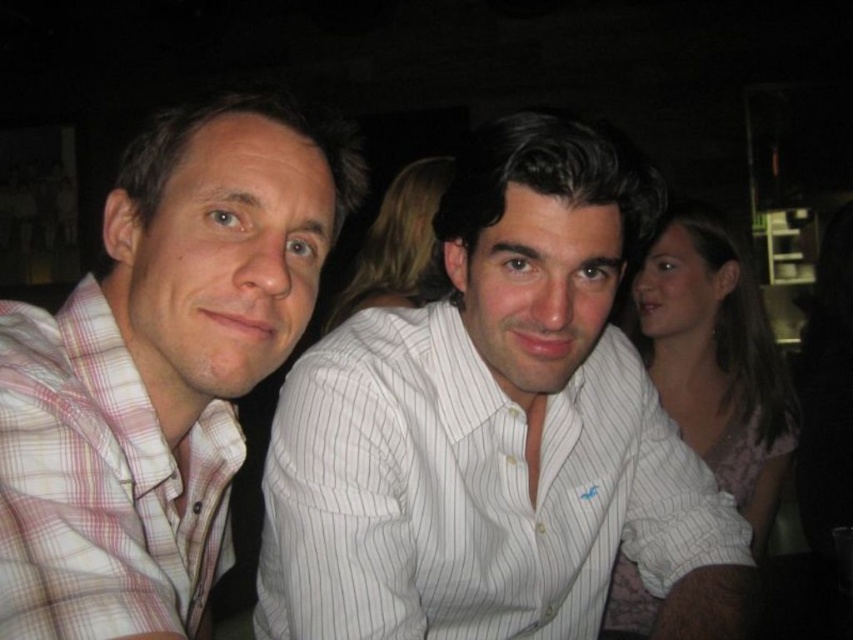
Does white striped shirt at center have a larger size compared to pink plaid shirt at left?

Yes, white striped shirt at center is bigger than pink plaid shirt at left.

Does white striped shirt at center have a smaller size compared to pink plaid shirt at left?

No, white striped shirt at center is not smaller than pink plaid shirt at left.

Who is more forward, (523, 518) or (183, 392)?

Point (183, 392) is more forward.

Identify the location of white striped shirt at center. The image size is (853, 640). (496, 429).

Between pink plaid shirt at left and plaid cotton shirt at left, which one has more height?

pink plaid shirt at left

Who is more forward, (x=73, y=310) or (x=7, y=452)?

Positioned in front is point (x=7, y=452).

You are a GUI agent. You are given a task and a screenshot of the screen. Output one action in this format:
    pyautogui.click(x=<x>, y=<y>)
    Task: Click on the pink plaid shirt at left
    The height and width of the screenshot is (640, 853).
    Given the screenshot: What is the action you would take?
    pyautogui.click(x=160, y=369)

Can you confirm if white striped shirt at center is positioned to the right of plaid cotton shirt at left?

Indeed, white striped shirt at center is positioned on the right side of plaid cotton shirt at left.

Which is in front, point (670, 529) or point (129, 614)?

Point (129, 614)

Does point (461, 228) come farther from viewer compared to point (177, 477)?

Yes, it is behind point (177, 477).

Find the location of `white striped shirt at center`. white striped shirt at center is located at coordinates (496, 429).